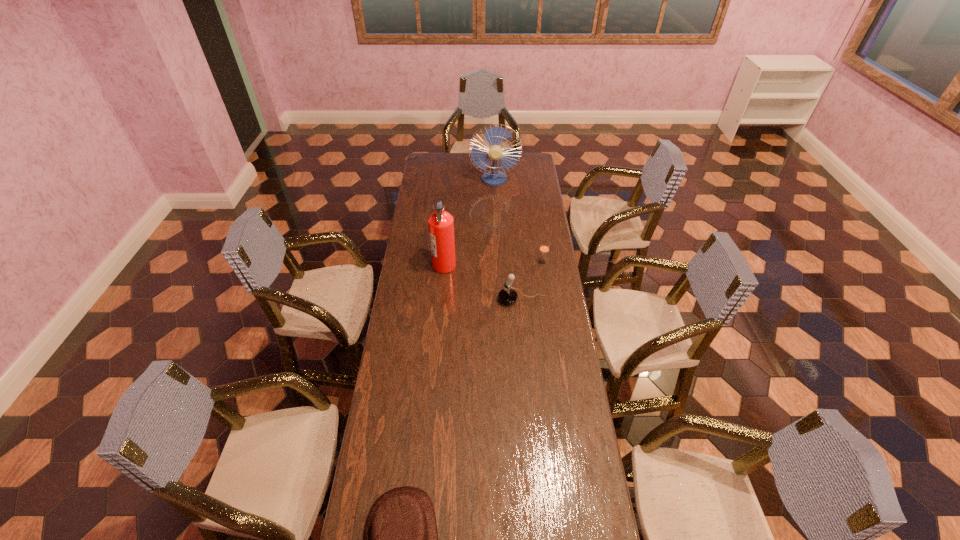
You are a GUI agent. You are given a task and a screenshot of the screen. Output one action in this format:
    pyautogui.click(x=<x>, y=<y>)
    Task: Click on the fire extinguisher
    
    Given the screenshot: What is the action you would take?
    pyautogui.click(x=441, y=223)

The image size is (960, 540). What are the coordinates of `fan` in the screenshot? It's located at (494, 136).

The width and height of the screenshot is (960, 540). Find the location of `the fourth farthest object`. the fourth farthest object is located at coordinates (507, 295).

Find the location of a particular element. straw is located at coordinates (544, 248).

At what (x,y) coordinates should I click in order to perform the action: click on free space located at the nozzle of the fire extinguisher. Please return your answer as a coordinate pair (x, y). This screenshot has width=960, height=540. Looking at the image, I should click on (485, 265).

Find the location of a particular element. free space located 0.190m at the front of the farthest object where the blades are visible is located at coordinates (495, 207).

This screenshot has height=540, width=960. Find the location of `free region located 0.170m on the front of the microphone`. free region located 0.170m on the front of the microphone is located at coordinates (525, 339).

The width and height of the screenshot is (960, 540). Identify the location of free space located on the front of the straw. (544, 272).

This screenshot has height=540, width=960. Identify the location of object present at the far edge. (494, 136).

Where is `object at the left edge`? This screenshot has width=960, height=540. object at the left edge is located at coordinates (441, 223).